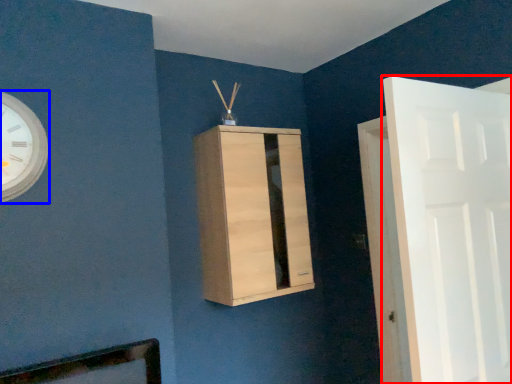
Question: Which object appears closest to the camera in this image, door (highlighted by a red box) or wall clock (highlighted by a blue box)?

Choices:
 (A) door
 (B) wall clock

Answer: (A)